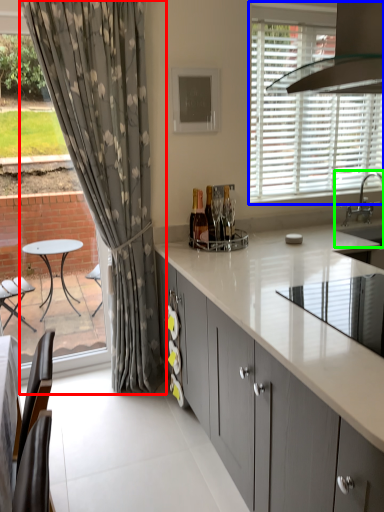
Question: Estimate the real-world distances between objects in this image. Which object is closer to curtain (highlighted by a red box), window (highlighted by a blue box) or sink (highlighted by a green box)?

Choices:
 (A) window
 (B) sink

Answer: (A)